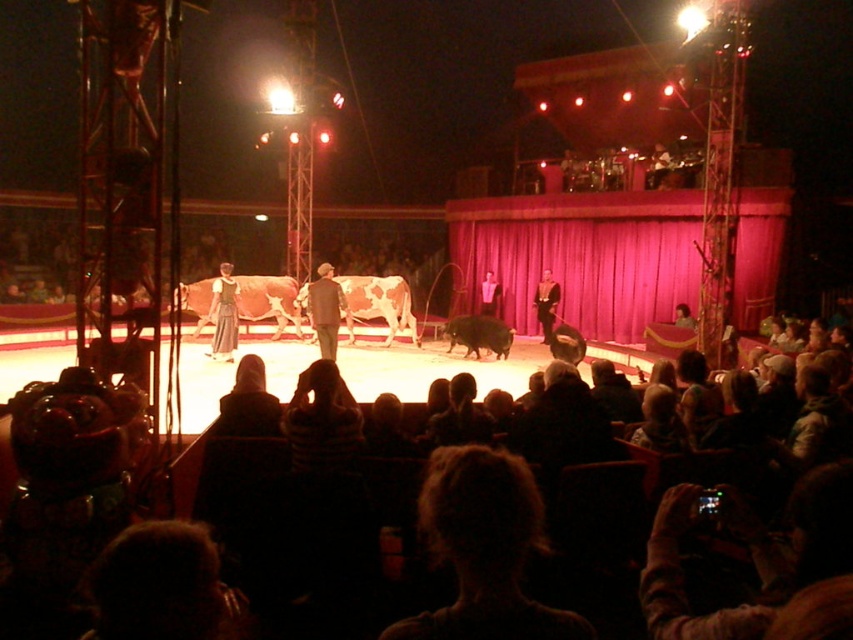
You are a photographer at the circus performance. You need to capture a photo of both the dark hair at lower center and the formal black suit at center in the same frame. Based on their positions, which side should you position yourself to ensure both are visible?

Since the dark hair at lower center is to the left of the formal black suit at center, positioning yourself to the left of both objects will allow you to capture both in the same frame.

You are a stagehand at the circus and need to place a new spotlight exactly at the center of the stage. The stage coordinates are given as a grid from 0 to 1 in both x and y directions. You see the formal black suit at center. Where should you aim the spotlight to hit the center of the stage?

The formal black suit at center is located at point (x=546, y=304), so the spotlight should be aimed at the center of the stage coordinates, which is at point (x=426, y=320).

From the picture: You are a photographer at the circus and want to capture the dark hair at lower center. Where should you aim your camera to get the best shot?

You should aim your camera at point [293,529] to capture the dark hair at lower center.